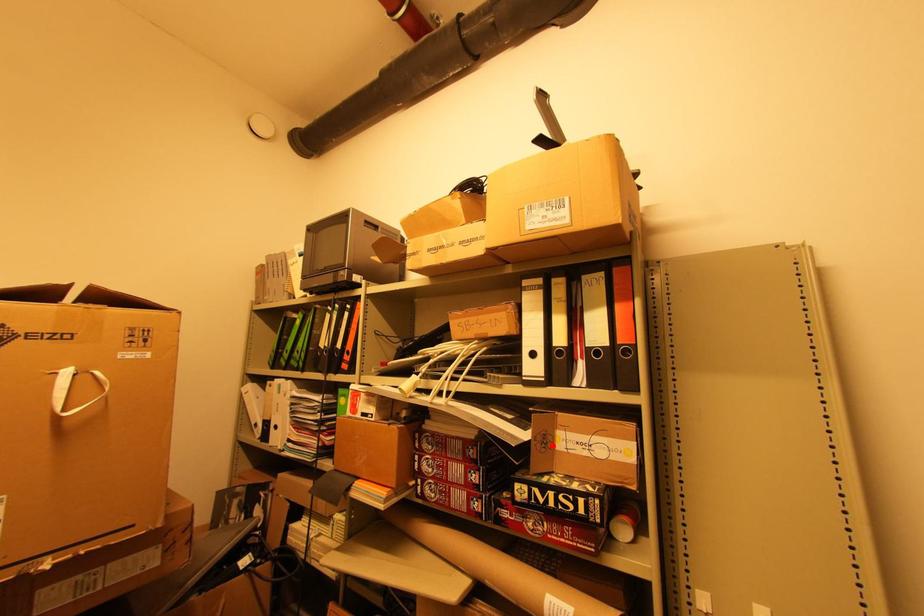
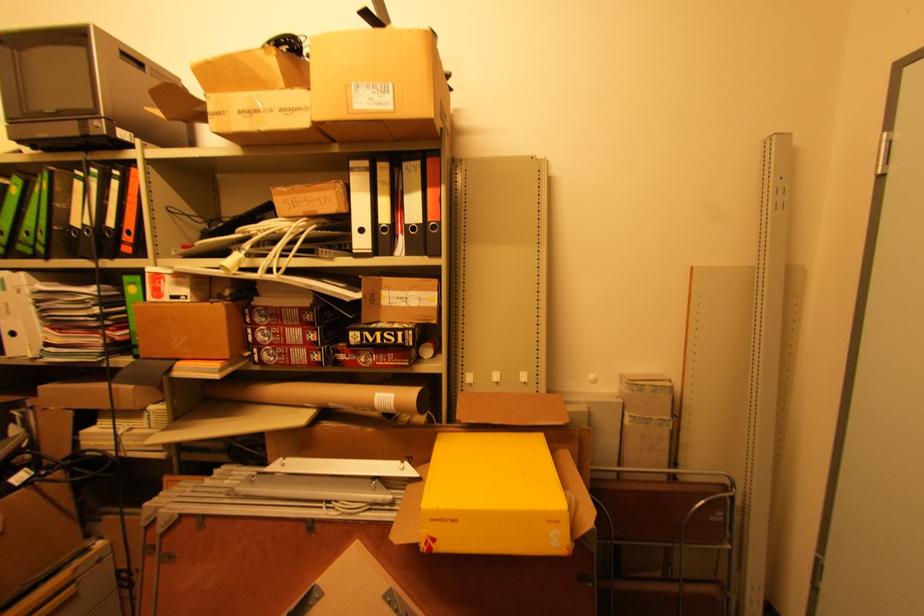
Where in the second image is the point corresponding to the highlighted location from the first image?

(380, 302)